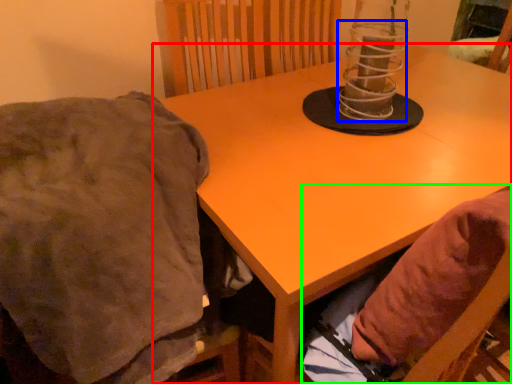
Question: Which is nearer to the table (highlighted by a red box)? candle holder (highlighted by a blue box) or bean bag chair (highlighted by a green box).

Choices:
 (A) candle holder
 (B) bean bag chair

Answer: (B)